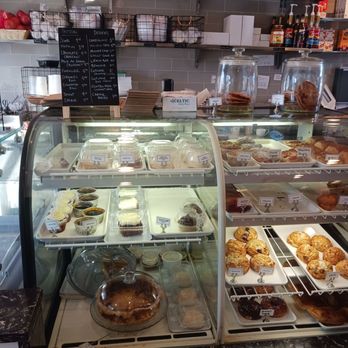
Locate an element on the screen. Image resolution: width=348 pixels, height=348 pixels. cookie jars is located at coordinates (241, 92), (300, 92).